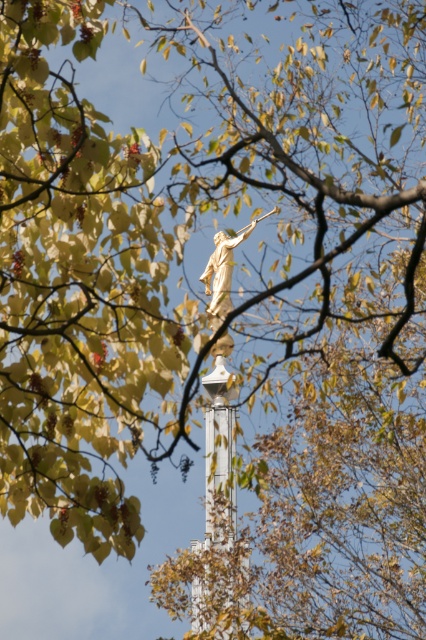
You are standing in a park and see a golden statue on a white column surrounded by autumn trees. There is a point marked at coordinates (218, 508). What does this point indicate?

The point at (218, 508) marks the location of the white glossy tower at center.

You are an architect assessing the structural integrity of the white glossy tower at center and the gold metallic statue at center. Which object is taller?

The white glossy tower at center is taller than the gold metallic statue at center.

You are an architect examining the image. You need to determine which object, the white glossy tower at center or the gold metallic statue at center, would cast a longer shadow during midday. Based on their sizes, which one would cast a longer shadow?

The white glossy tower at center has a larger size compared to the gold metallic statue at center, so it would cast a longer shadow during midday.